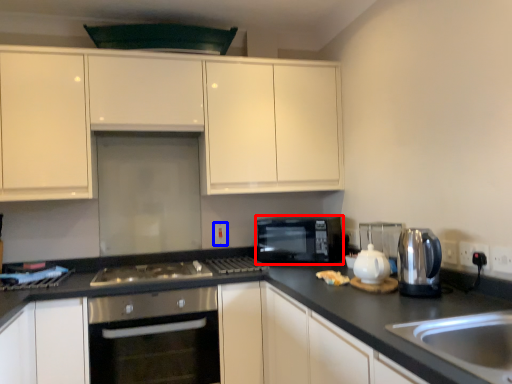
Question: Which of the following is the closest to the observer, microwave oven (highlighted by a red box) or electric outlet (highlighted by a blue box)?

Choices:
 (A) microwave oven
 (B) electric outlet

Answer: (A)